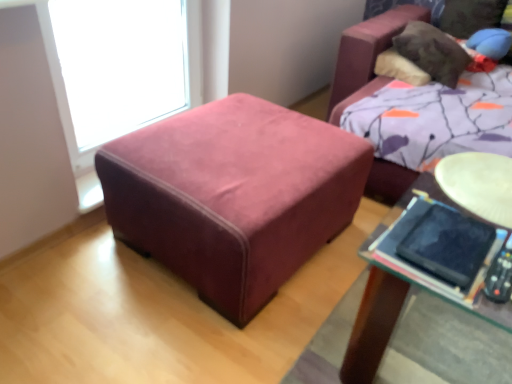
Question: From a real-world perspective, relative to velvet ottoman at center, is transparent glass window at upper left vertically above or below?

Choices:
 (A) below
 (B) above

Answer: (B)

Question: Considering the relative positions of transparent glass window at upper left and velvet ottoman at center in the image provided, is transparent glass window at upper left to the left or to the right of velvet ottoman at center?

Choices:
 (A) right
 (B) left

Answer: (B)

Question: Based on their relative distances, which object is nearer to the black matte tablet at lower right?

Choices:
 (A) transparent glass window at upper left
 (B) light brown wooden round table at center right
 (C) velvet ottoman at center

Answer: (B)

Question: Considering the real-world distances, which object is closest to the black matte tablet at lower right?

Choices:
 (A) transparent glass window at upper left
 (B) light brown wooden round table at center right
 (C) velvet ottoman at center

Answer: (B)